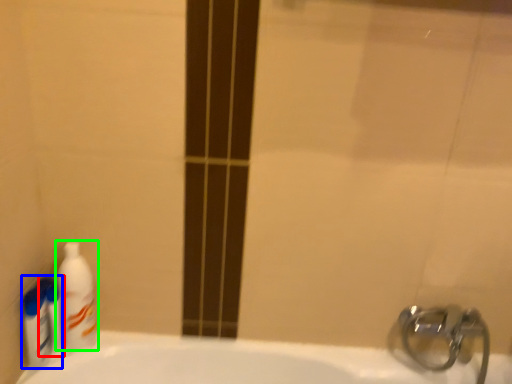
Question: Which is farther away from mouthwash (highlighted by a red box)? cleaning product (highlighted by a blue box) or cleaning product (highlighted by a green box)?

Choices:
 (A) cleaning product
 (B) cleaning product

Answer: (B)